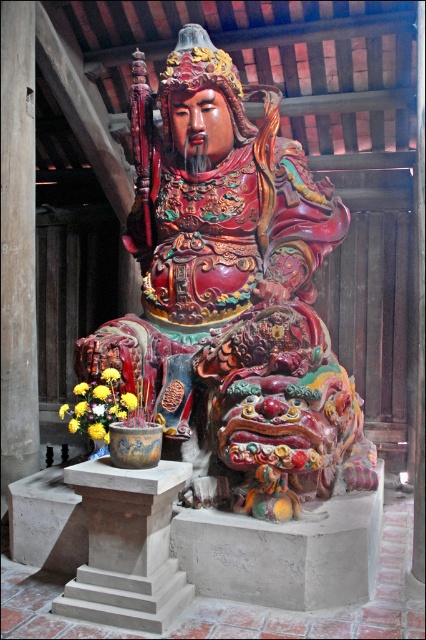
Question: Is glossy painted wood statue at center above gray concrete pedestal at lower left?

Choices:
 (A) no
 (B) yes

Answer: (B)

Question: In this image, where is glossy painted wood statue at center located relative to gray concrete pedestal at lower left?

Choices:
 (A) right
 (B) left

Answer: (A)

Question: Among these points, which one is nearest to the camera?

Choices:
 (A) (109, 493)
 (B) (302, 246)

Answer: (A)

Question: Which object is farther from the camera taking this photo?

Choices:
 (A) gray concrete pedestal at lower left
 (B) glossy painted wood statue at center

Answer: (B)

Question: Is glossy painted wood statue at center to the right of gray concrete pedestal at lower left from the viewer's perspective?

Choices:
 (A) no
 (B) yes

Answer: (B)